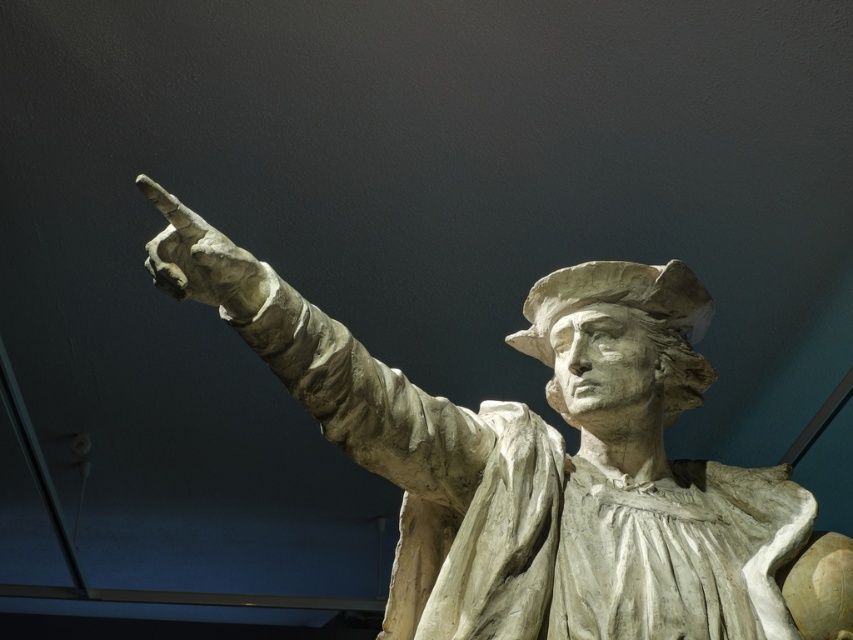
Who is taller, white stone statue at center or white stone hand at upper left?

Standing taller between the two is white stone statue at center.

Which is above, white stone statue at center or white stone hand at upper left?

white stone hand at upper left is higher up.

The width and height of the screenshot is (853, 640). What do you see at coordinates (531, 460) in the screenshot? I see `white stone statue at center` at bounding box center [531, 460].

The width and height of the screenshot is (853, 640). What are the coordinates of `white stone statue at center` in the screenshot? It's located at (531, 460).